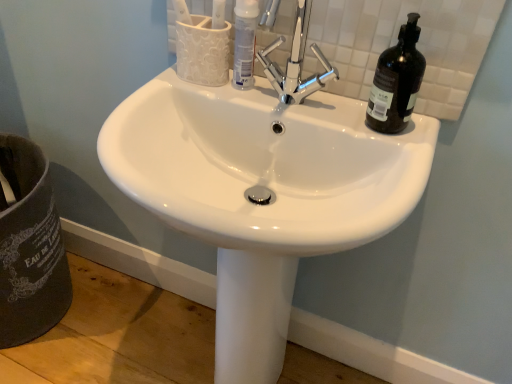
The image size is (512, 384). I want to click on spots to the right of white glossy tube at center, so click(x=305, y=93).